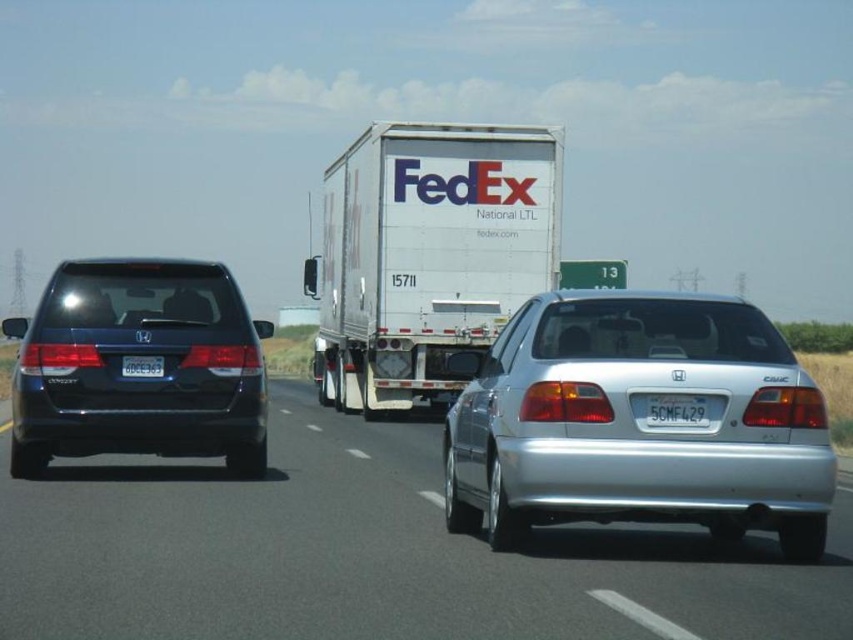
You are a pedestrian standing on the sidewalk and see the silver metallic car at center and the white plastic license plate at rear left. How far apart are these two objects?

The silver metallic car at center is 7.90 feet away from the white plastic license plate at rear left.

You are a pedestrian standing at the side of the highway and see the silver metallic sedan at center and the matte black minivan at left. Which vehicle is closer to the right edge of the highway?

The silver metallic sedan at center is positioned on the right side of the matte black minivan at left, so it is closer to the right edge of the highway.